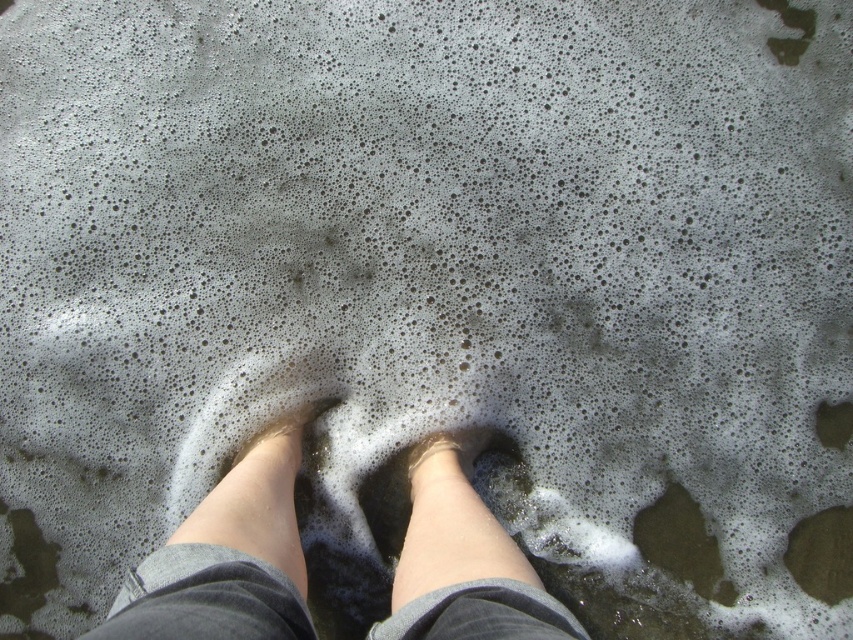
I want to click on smooth skin legs at center, so click(x=228, y=556).

Is point (248, 604) in front of point (480, 426)?

Yes, point (248, 604) is closer to viewer.

Locate an element on the screen. This screenshot has width=853, height=640. smooth skin legs at center is located at coordinates (228, 556).